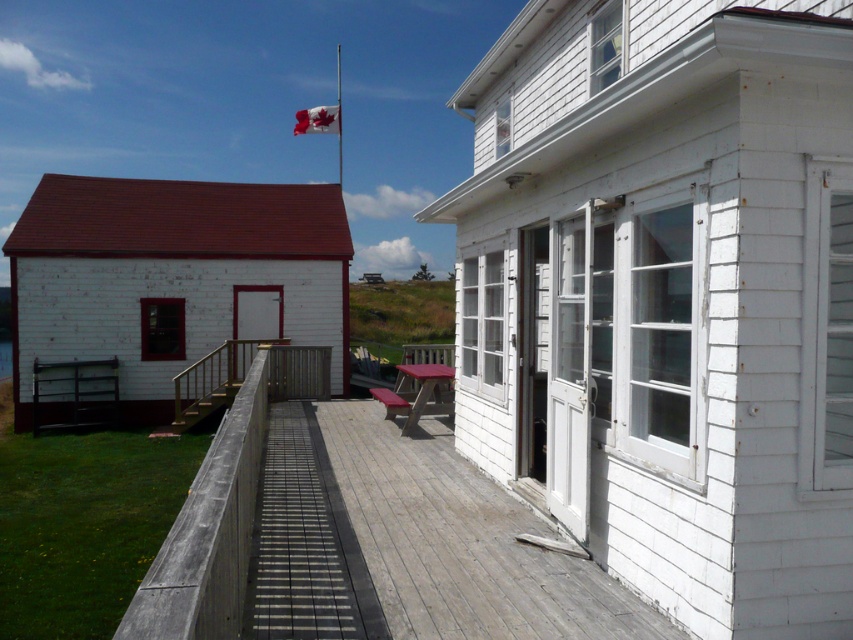
Between weathered wood deck at center and white wooden flag pole at upper center, which one is positioned lower?

weathered wood deck at center is lower down.

Is weathered wood deck at center to the left of white wooden flag pole at upper center from the viewer's perspective?

Incorrect, weathered wood deck at center is not on the left side of white wooden flag pole at upper center.

The height and width of the screenshot is (640, 853). Identify the location of weathered wood deck at center. (361, 538).

Between wooden at center and white wooden flag pole at upper center, which one has less height?

Standing shorter between the two is wooden at center.

Which is behind, point (180, 419) or point (340, 170)?

The point (340, 170) is more distant.

This screenshot has width=853, height=640. I want to click on wooden at center, so click(x=213, y=380).

Between point (308, 125) and point (340, 131), which one is positioned behind?

Point (308, 125)

Between red fabric flag at upper center and white wooden flag pole at upper center, which one is positioned lower?

Positioned lower is red fabric flag at upper center.

Who is more distant from viewer, (312, 120) or (341, 157)?

Point (341, 157)

This screenshot has height=640, width=853. Find the location of `red fabric flag at upper center`. red fabric flag at upper center is located at coordinates (317, 120).